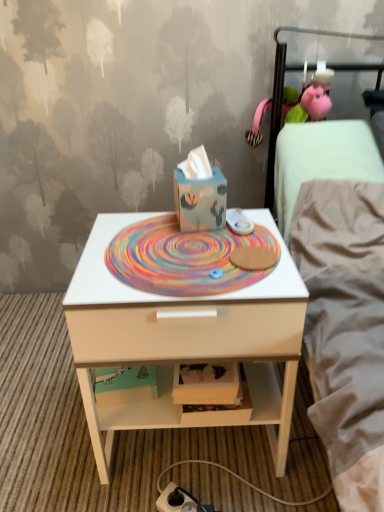
Question: Is white matte nightstand at center positioned with its back to white fabric bed at upper right?

Choices:
 (A) yes
 (B) no

Answer: (B)

Question: Is white matte nightstand at center closer to camera compared to white fabric bed at upper right?

Choices:
 (A) yes
 (B) no

Answer: (A)

Question: Considering the relative sizes of white matte nightstand at center and white fabric bed at upper right in the image provided, is white matte nightstand at center smaller than white fabric bed at upper right?

Choices:
 (A) no
 (B) yes

Answer: (B)

Question: Does white matte nightstand at center have a lesser width compared to white fabric bed at upper right?

Choices:
 (A) yes
 (B) no

Answer: (A)

Question: Considering the relative sizes of white matte nightstand at center and white fabric bed at upper right in the image provided, is white matte nightstand at center shorter than white fabric bed at upper right?

Choices:
 (A) yes
 (B) no

Answer: (A)

Question: Could white fabric bed at upper right be considered to be inside white matte nightstand at center?

Choices:
 (A) yes
 (B) no

Answer: (B)

Question: Considering the relative positions of white matte nightstand at center and matte blue cardboard box at center in the image provided, is white matte nightstand at center to the right of matte blue cardboard box at center from the viewer's perspective?

Choices:
 (A) no
 (B) yes

Answer: (A)

Question: Does white matte nightstand at center have a greater height compared to matte blue cardboard box at center?

Choices:
 (A) no
 (B) yes

Answer: (B)

Question: Are white matte nightstand at center and matte blue cardboard box at center far apart?

Choices:
 (A) yes
 (B) no

Answer: (B)

Question: Can you confirm if white matte nightstand at center is positioned to the left of matte blue cardboard box at center?

Choices:
 (A) yes
 (B) no

Answer: (A)

Question: Is matte blue cardboard box at center at the back of white matte nightstand at center?

Choices:
 (A) no
 (B) yes

Answer: (A)

Question: From the image's perspective, is white matte nightstand at center above matte blue cardboard box at center?

Choices:
 (A) yes
 (B) no

Answer: (B)

Question: Considering the relative positions of matte blue cardboard box at center and white matte nightstand at center in the image provided, is matte blue cardboard box at center to the right of white matte nightstand at center from the viewer's perspective?

Choices:
 (A) no
 (B) yes

Answer: (B)